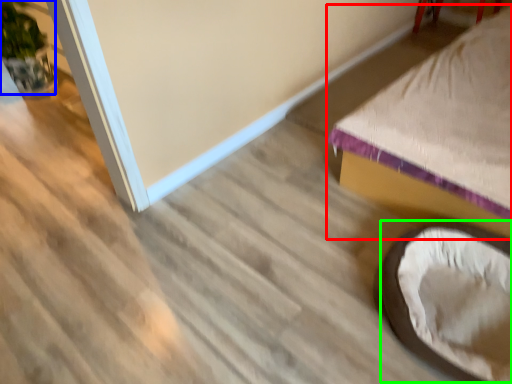
Question: Which object is positioned closest to furniture (highlighted by a red box)? Select from plant (highlighted by a blue box) and bean bag chair (highlighted by a green box).

Choices:
 (A) plant
 (B) bean bag chair

Answer: (B)